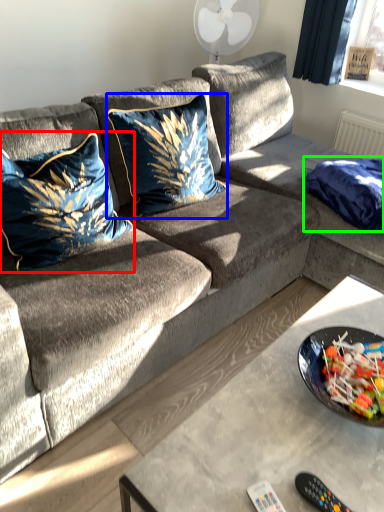
Question: Which object is positioned farthest from pillow (highlighted by a red box)? Select from pillow (highlighted by a blue box) and blanket (highlighted by a green box).

Choices:
 (A) pillow
 (B) blanket

Answer: (B)